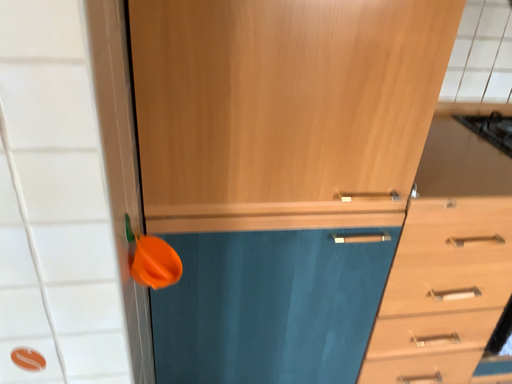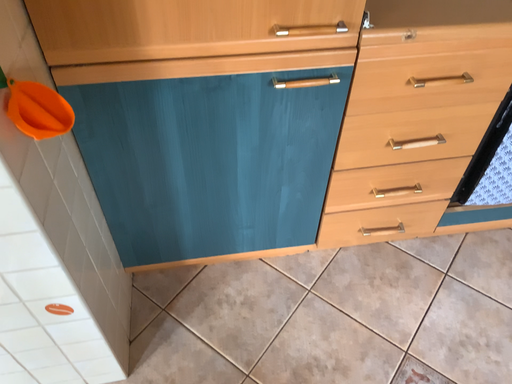
Question: How did the camera likely rotate when shooting the video?

Choices:
 (A) rotated upward
 (B) rotated downward

Answer: (B)